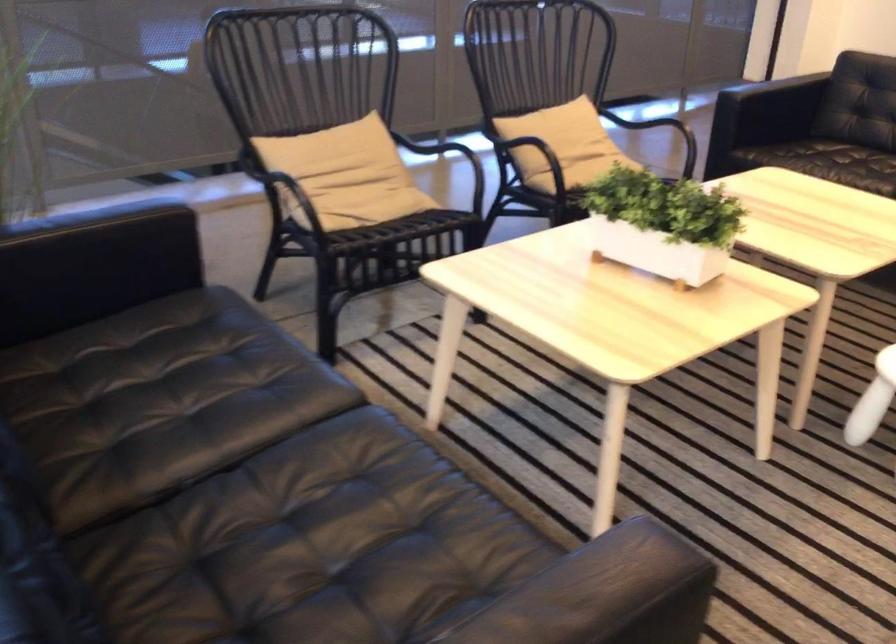
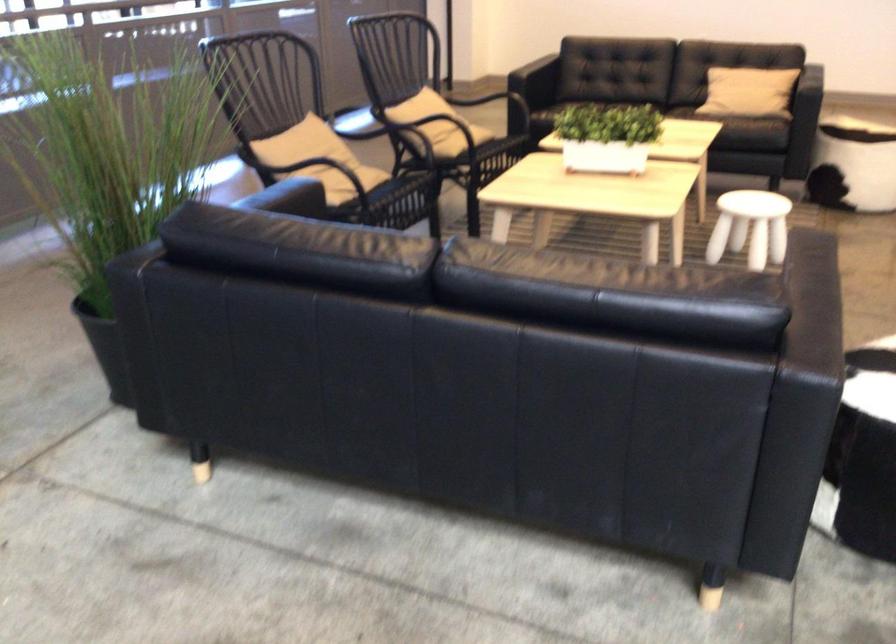
Find the pixel in the second image that matches (x=314, y=164) in the first image.

(308, 153)